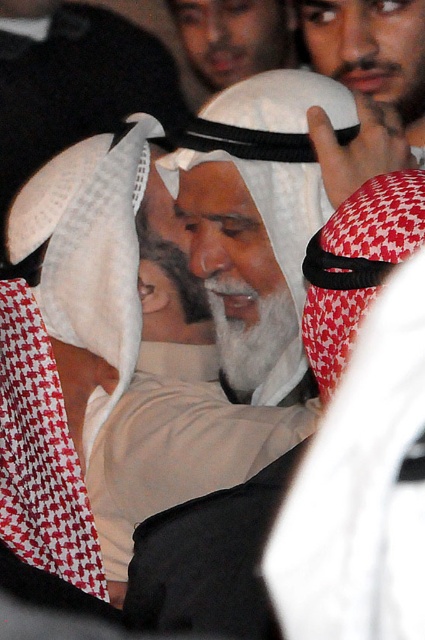
In the scene described, which object is positioned higher between the white matte headscarf at upper center and the white matte keffiyeh at center?

The white matte keffiyeh at center is positioned higher than the white matte headscarf at upper center.

Looking at this image, you are a photographer standing at the scene. You want to take a close up shot of the white matte headscarf at upper center. What is the minimum distance you need to move forward to get the shot?

The white matte headscarf at upper center is 1.81 meters away from the viewer. To take a close up shot, you need to move forward until you are within the minimum focusing distance of your camera lens. However, since the exact minimum focusing distance isn

Based on the photo, you are standing in front of the group and want to determine which of the two points, point (374, 4) or point (240, 76), is closer to you. Based on the scene, which point is nearer?

Point (374, 4) is closer to the viewer than point (240, 76).